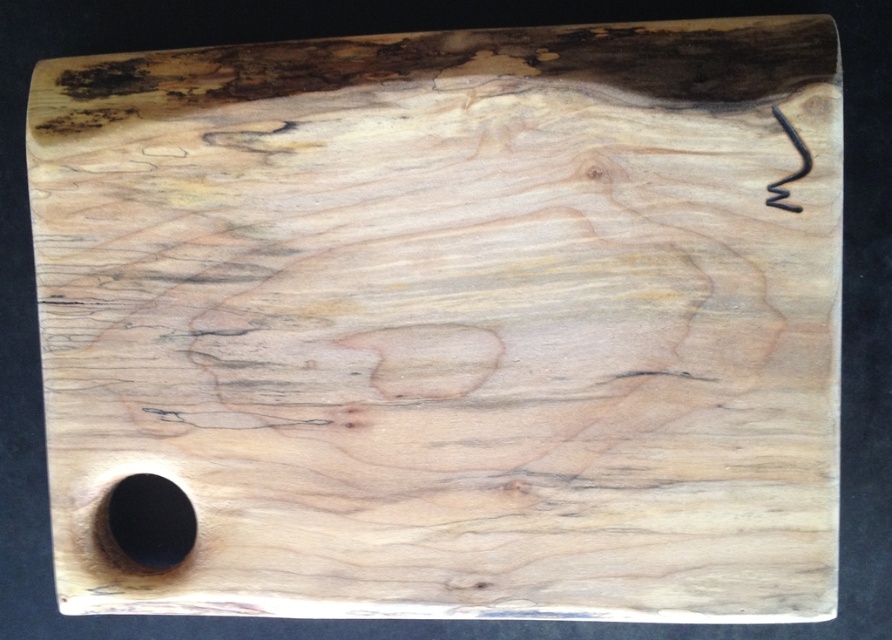
Question: Which point is closer to the camera?

Choices:
 (A) black matte hole at bottom left
 (B) matte black hook at upper right

Answer: (B)

Question: Which point appears farthest from the camera in this image?

Choices:
 (A) (797, 173)
 (B) (106, 509)

Answer: (B)

Question: Is black matte hole at bottom left behind matte black hook at upper right?

Choices:
 (A) no
 (B) yes

Answer: (B)

Question: Can you confirm if black matte hole at bottom left is bigger than matte black hook at upper right?

Choices:
 (A) yes
 (B) no

Answer: (A)

Question: Can you confirm if black matte hole at bottom left is positioned below matte black hook at upper right?

Choices:
 (A) yes
 (B) no

Answer: (A)